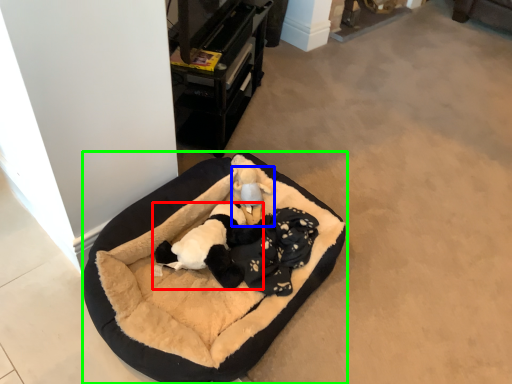
Question: Which is nearer to the animal (highlighted by a red box)? toy (highlighted by a blue box) or dog bed (highlighted by a green box).

Choices:
 (A) toy
 (B) dog bed

Answer: (B)